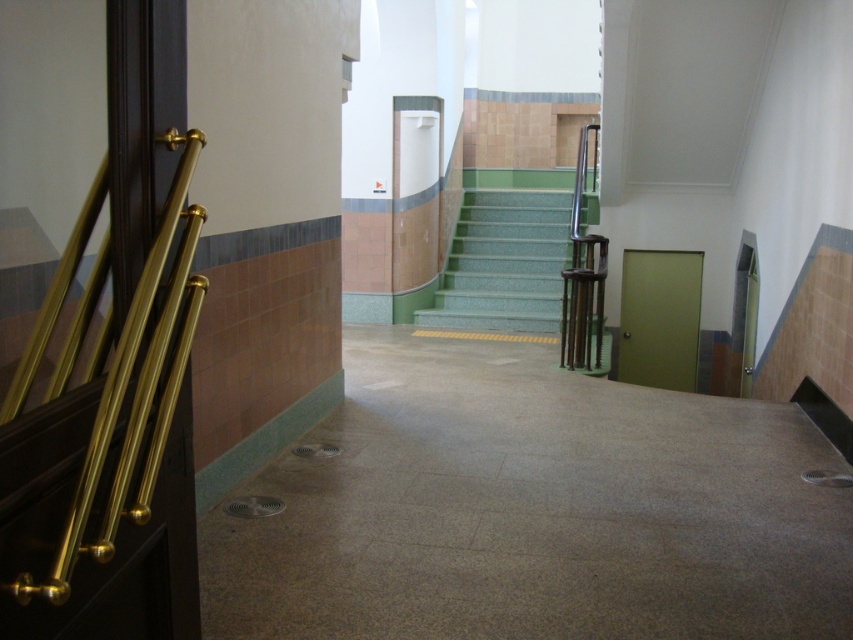
Question: Does green speckled tile stairs at center have a larger size compared to metallic polished rail at center-right?

Choices:
 (A) no
 (B) yes

Answer: (B)

Question: Is green speckled tile stairs at center behind metallic polished rail at center-right?

Choices:
 (A) no
 (B) yes

Answer: (B)

Question: Which point is farther from the camera taking this photo?

Choices:
 (A) (490, 220)
 (B) (602, 253)

Answer: (A)

Question: Is green speckled tile stairs at center positioned at the back of metallic polished rail at center-right?

Choices:
 (A) yes
 (B) no

Answer: (A)

Question: Which point is farther to the camera?

Choices:
 (A) green speckled tile stairs at center
 (B) metallic polished rail at center-right

Answer: (A)